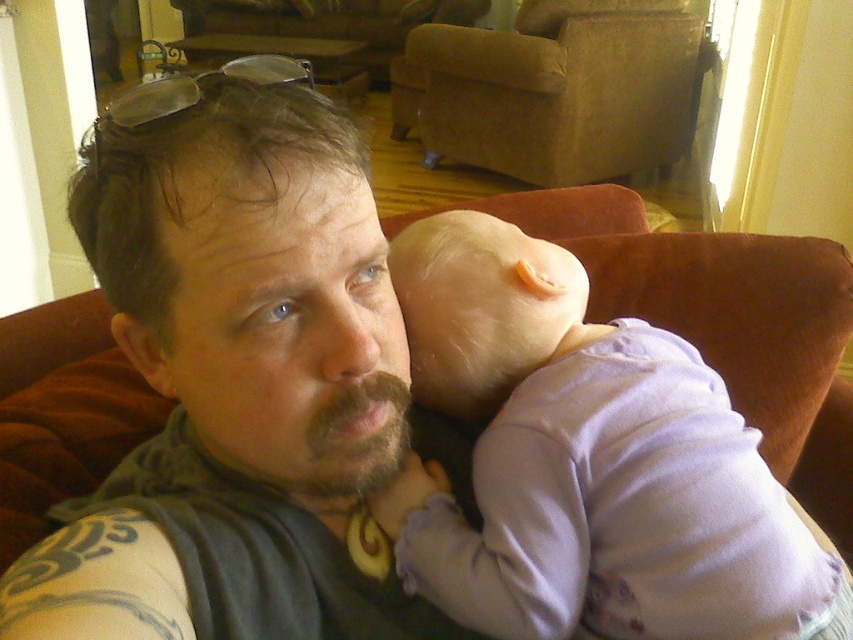
Looking at this image, you are a tailor who needs to measure the purple soft fabric at center for a new project. The coordinates provided are in a normalized system where the bottom left corner is the origin. Can you confirm if the point at (x=587, y=460) falls within the boundaries of the purple soft fabric at center?

The point at (x=587, y=460) is marked as the location of the purple soft fabric at center, so yes, the coordinates fall within the purple soft fabric at center.

You are designing a new living room layout and want to place the dark gray vest at center and the brown suede armchair at upper center. Based on their sizes, which object should you place first to ensure they fit properly?

The dark gray vest at center has a smaller width than the brown suede armchair at upper center. Therefore, you should place the brown suede armchair at upper center first to accommodate its larger size before positioning the smaller dark gray vest at center.

You are a photographer setting up a shoot in this living room. You need to place a small prop exactly at the point marked as point (254, 352). What object is located at that point?

The dark gray vest at center is located at point (254, 352).